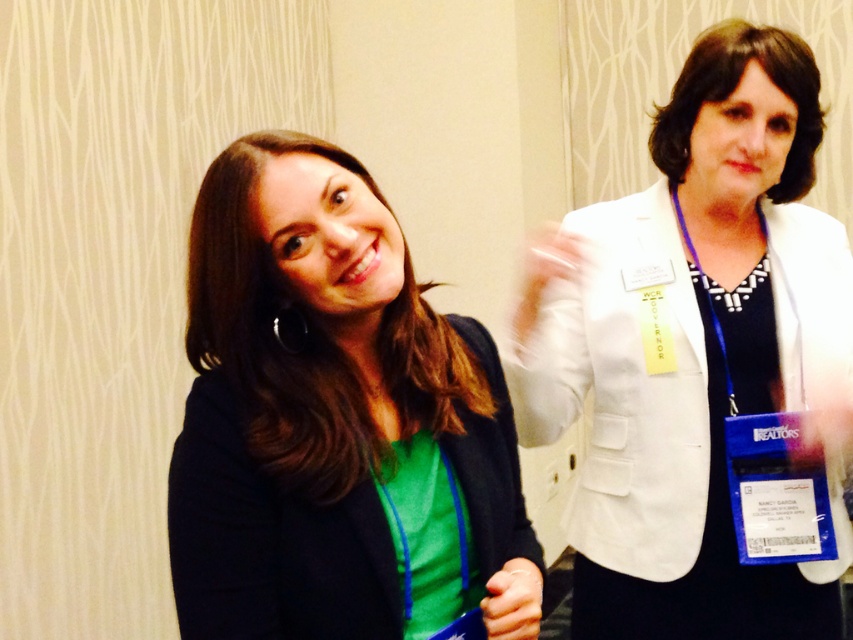
Question: Can you confirm if matte black blazer at center is wider than white matte blazer at upper right?

Choices:
 (A) yes
 (B) no

Answer: (B)

Question: Which point is farther to the camera?

Choices:
 (A) (657, 561)
 (B) (515, 586)
 (C) (312, 227)

Answer: (A)

Question: Which point is farther to the camera?

Choices:
 (A) (485, 586)
 (B) (422, 433)

Answer: (B)

Question: Which point is closer to the camera taking this photo?

Choices:
 (A) (517, 604)
 (B) (611, 492)

Answer: (A)

Question: Can you confirm if white matte blazer at upper right is thinner than smooth skin hand at lower center?

Choices:
 (A) no
 (B) yes

Answer: (A)

Question: Does white matte blazer at upper right have a smaller size compared to translucent plastic hand at upper center?

Choices:
 (A) no
 (B) yes

Answer: (A)